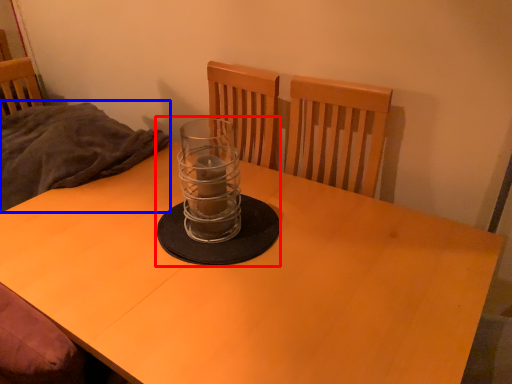
Question: Which of the following is the farthest to the observer, candle holder (highlighted by a red box) or blanket (highlighted by a blue box)?

Choices:
 (A) candle holder
 (B) blanket

Answer: (B)